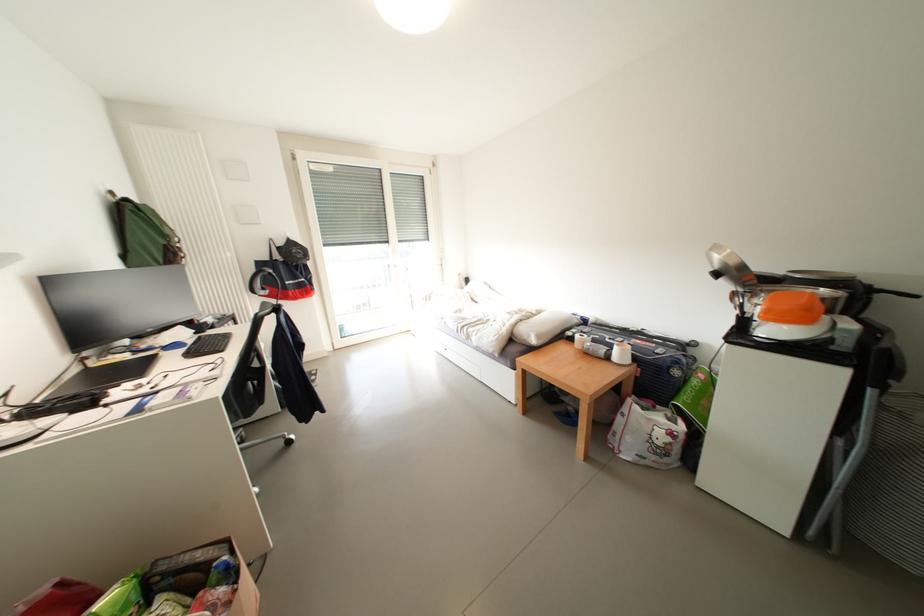
You are a GUI agent. You are given a task and a screenshot of the screen. Output one action in this format:
    pyautogui.click(x=<x>, y=<y>)
    Task: Click on the white plastic cup
    
    Given the screenshot: What is the action you would take?
    pyautogui.click(x=621, y=353)